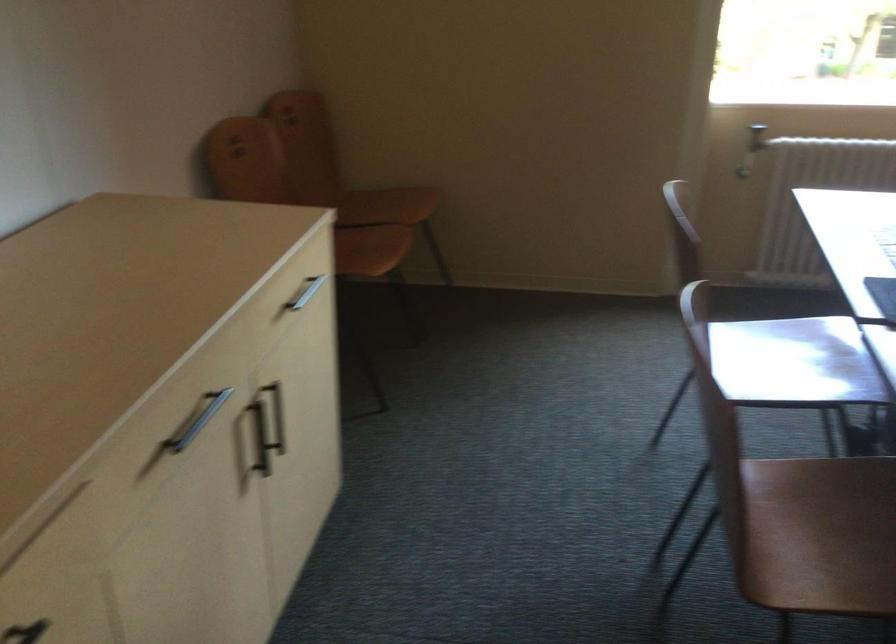
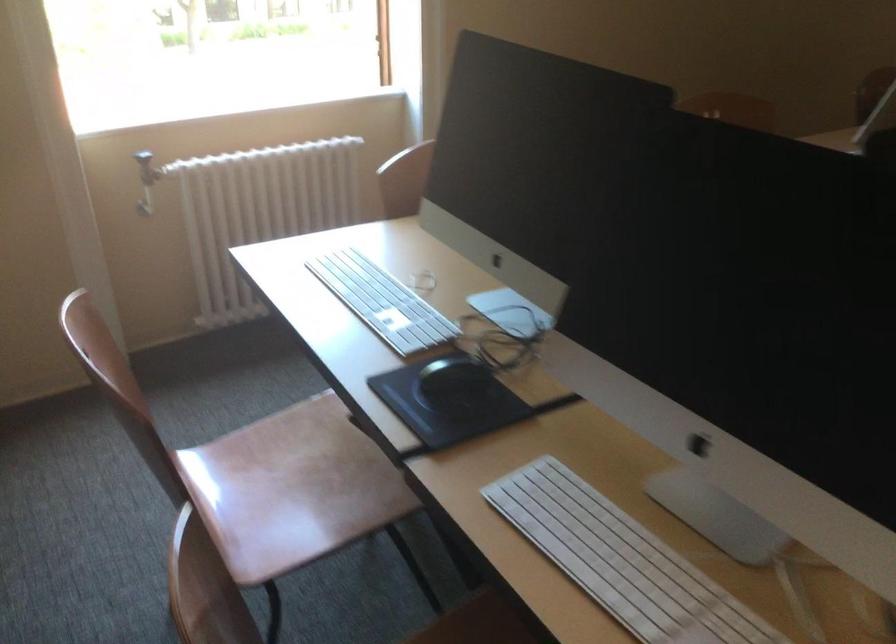
Where in the second image is the point corresponding to (769,357) from the first image?

(291, 488)